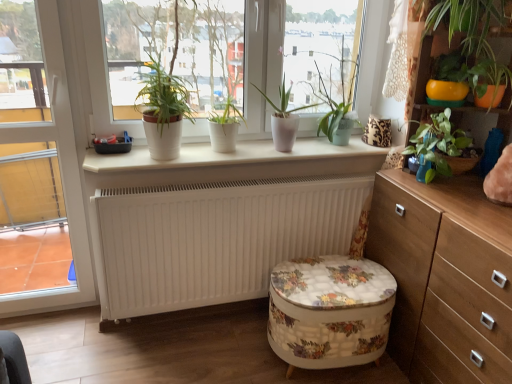
This screenshot has width=512, height=384. Identify the location of free space on the front side of green glossy plant at upper right, the second houseplant positioned from the right. click(x=461, y=206).